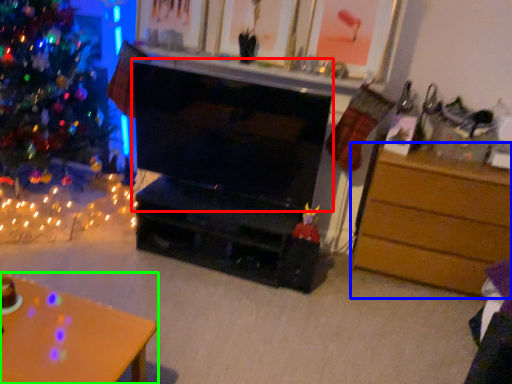
Question: Which is nearer to the fireplace (highlighted by a red box)? chest of drawers (highlighted by a blue box) or desk (highlighted by a green box).

Choices:
 (A) chest of drawers
 (B) desk

Answer: (A)